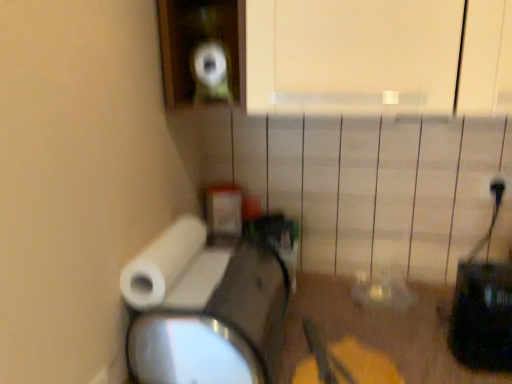
Question: In terms of width, does white plastic electric outlet at upper right look wider or thinner when compared to white matte toilet paper at lower left?

Choices:
 (A) wide
 (B) thin

Answer: (B)

Question: Is white plastic electric outlet at upper right inside the boundaries of white matte toilet paper at lower left, or outside?

Choices:
 (A) inside
 (B) outside

Answer: (B)

Question: Considering the positions of white plastic electric outlet at upper right and white matte toilet paper at lower left in the image, is white plastic electric outlet at upper right taller or shorter than white matte toilet paper at lower left?

Choices:
 (A) tall
 (B) short

Answer: (B)

Question: Is point (173, 240) closer or farther from the camera than point (487, 183)?

Choices:
 (A) closer
 (B) farther

Answer: (A)

Question: Is white matte toilet paper at lower left inside the boundaries of white plastic electric outlet at upper right, or outside?

Choices:
 (A) inside
 (B) outside

Answer: (B)

Question: Is white matte toilet paper at lower left in front of or behind white plastic electric outlet at upper right in the image?

Choices:
 (A) behind
 (B) front

Answer: (B)

Question: In terms of height, does white matte toilet paper at lower left look taller or shorter compared to white plastic electric outlet at upper right?

Choices:
 (A) tall
 (B) short

Answer: (A)